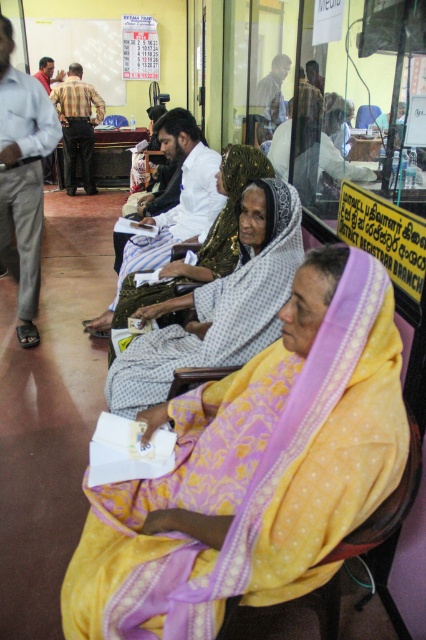
Can you confirm if yellow fabric headscarf at center is smaller than red shirt at center?

No.

Who is more forward, (287, 300) or (48, 88)?

Point (287, 300)

This screenshot has width=426, height=640. I want to click on yellow fabric headscarf at center, so click(x=218, y=305).

Is plaid shirt at center below light brown wooden chair at upper center?

No, plaid shirt at center is not below light brown wooden chair at upper center.

Is point (63, 90) more distant than point (264, 118)?

Yes, point (63, 90) is farther from viewer.

Does point (86, 157) lie behind point (259, 136)?

That is True.

In order to click on plaid shirt at center in this screenshot , I will do `click(77, 125)`.

Does point (161, 580) come farther from viewer compared to point (6, 145)?

No, (161, 580) is in front of (6, 145).

Can you confirm if yellow printed saree at center is taller than gray cotton shirt at left?

No.

Who is more forward, (250,548) or (22,225)?

Point (250,548)

The width and height of the screenshot is (426, 640). I want to click on yellow printed saree at center, so click(x=253, y=470).